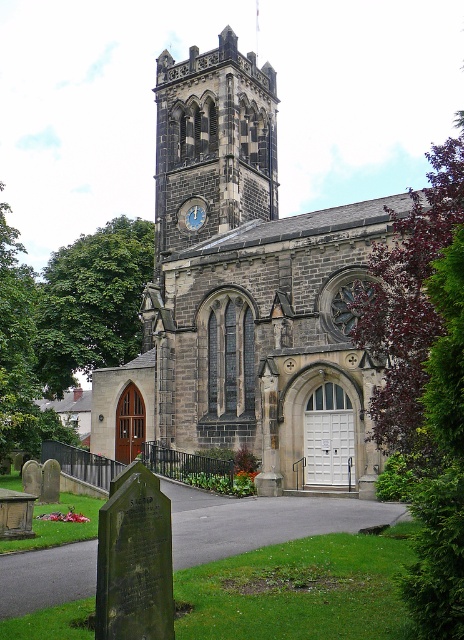
You are a maintenance worker needing to inspect both the dark gray stone clock tower at upper center and the blue stone clock at upper center. Given that you can only climb a ladder up to 10 meters, can you reach both objects with your current equipment?

The distance between the dark gray stone clock tower at upper center and the blue stone clock at upper center is 10.76 meters. Since your ladder can only reach up to 10 meters, you cannot safely reach both objects with your current equipment.

You are standing in front of the historic stone church and want to take a photo of both the dark gray stone clock tower at upper center and the blue stone clock at upper center. Which one will appear larger in the photo?

The dark gray stone clock tower at upper center will appear larger in the photo because it is much taller than the blue stone clock at upper center.